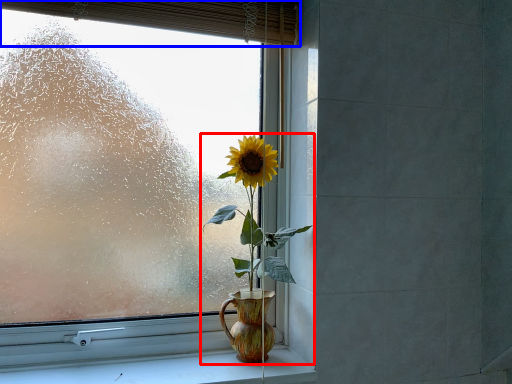
Question: Which of the following is the farthest to the observer, houseplant (highlighted by a red box) or curtain (highlighted by a blue box)?

Choices:
 (A) houseplant
 (B) curtain

Answer: (A)